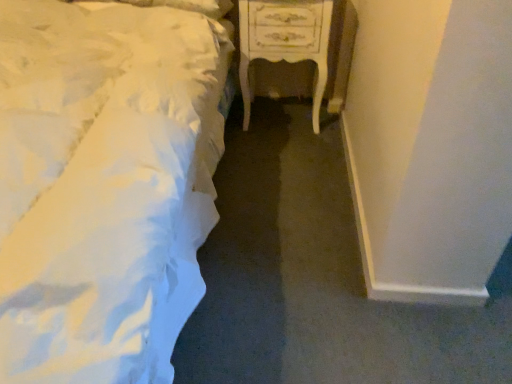
Locate an element on the screen. Image resolution: width=512 pixels, height=384 pixels. white glossy nightstand at center is located at coordinates (285, 42).

Describe the element at coordinates (285, 42) in the screenshot. I see `white glossy nightstand at center` at that location.

Image resolution: width=512 pixels, height=384 pixels. What are the coordinates of `white glossy nightstand at center` in the screenshot? It's located at (285, 42).